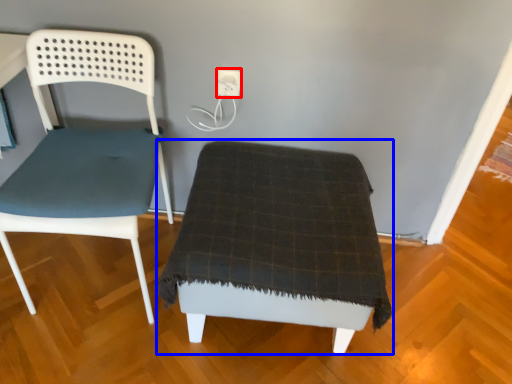
Question: Which of the following is the farthest to the observer, electric outlet (highlighted by a red box) or furniture (highlighted by a blue box)?

Choices:
 (A) electric outlet
 (B) furniture

Answer: (A)